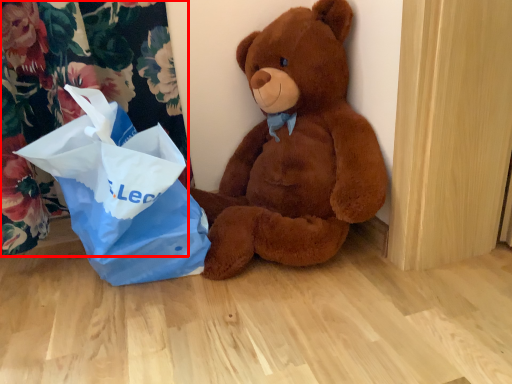
Question: From the image, what is the correct spatial relationship of curtain (annotated by the red box) in relation to teddy bear?

Choices:
 (A) left
 (B) right

Answer: (A)